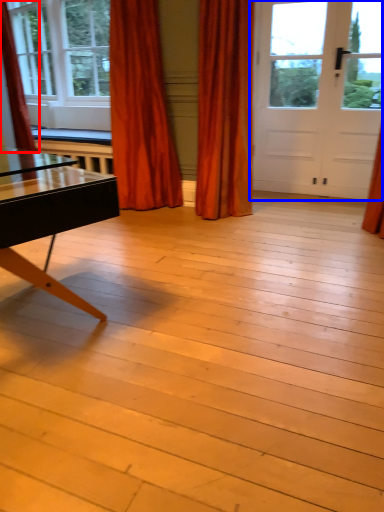
Question: Which point is closer to the camera, curtain (highlighted by a red box) or door (highlighted by a blue box)?

Choices:
 (A) curtain
 (B) door

Answer: (A)